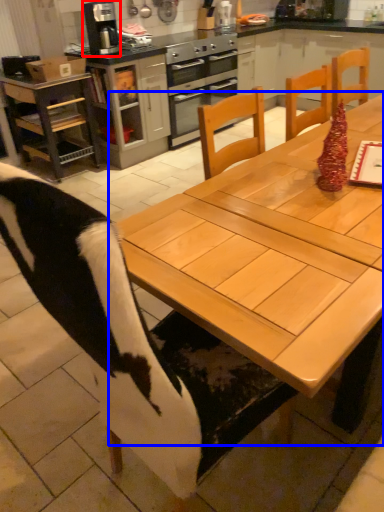
Question: Which object is closer to the camera taking this photo, kitchen appliance (highlighted by a red box) or table (highlighted by a blue box)?

Choices:
 (A) kitchen appliance
 (B) table

Answer: (B)